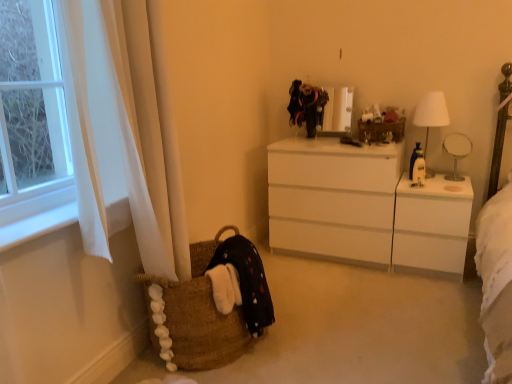
The image size is (512, 384). What do you see at coordinates (432, 225) in the screenshot?
I see `white glossy changing table at right` at bounding box center [432, 225].

What do you see at coordinates (198, 315) in the screenshot? The image size is (512, 384). I see `brown woven basket at lower left` at bounding box center [198, 315].

The height and width of the screenshot is (384, 512). What do you see at coordinates (381, 130) in the screenshot?
I see `wooden basket at center` at bounding box center [381, 130].

Where is `velvet black dress at upper center, which ranks as the second clothing in front-to-back order`? velvet black dress at upper center, which ranks as the second clothing in front-to-back order is located at coordinates (306, 105).

You are a GUI agent. You are given a task and a screenshot of the screen. Output one action in this format:
    pyautogui.click(x=<x>, y=<y>)
    Task: Click on the black cotton dress at lower left, which ranks as the first clothing in bottom-to-top order
    The width and height of the screenshot is (512, 384).
    Given the screenshot: What is the action you would take?
    pyautogui.click(x=248, y=281)

What do you see at coordinates (248, 281) in the screenshot?
I see `black cotton dress at lower left, which appears as the second clothing when viewed from the back` at bounding box center [248, 281].

Find the location of a particular element. white glossy table lamp at right is located at coordinates (456, 152).

The height and width of the screenshot is (384, 512). What do you see at coordinates (364, 207) in the screenshot?
I see `white glossy chest of drawers at center` at bounding box center [364, 207].

At what (x,y) coordinates should I click in order to perform the action: click on white glossy changing table at right. Please return your answer as a coordinate pair (x, y). This screenshot has height=384, width=512. Looking at the image, I should click on (432, 225).

Considering the positions of objects wooden basket at center and velvet black dress at upper center, which is the 1th clothing in back-to-front order, in the image provided, who is more to the left, wooden basket at center or velvet black dress at upper center, which is the 1th clothing in back-to-front order,?

velvet black dress at upper center, which is the 1th clothing in back-to-front order, is more to the left.

Is wooden basket at center facing away from velvet black dress at upper center, which is the 1th clothing in back-to-front order?

That's not correct — wooden basket at center is not looking away from velvet black dress at upper center, which is the 1th clothing in back-to-front order.

Measure the distance from wooden basket at center to velvet black dress at upper center, which ranks as the second clothing in front-to-back order.

wooden basket at center and velvet black dress at upper center, which ranks as the second clothing in front-to-back order, are 15.30 inches apart from each other.

Is wooden basket at center in contact with velvet black dress at upper center, the second clothing ordered from the bottom?

wooden basket at center is not next to velvet black dress at upper center, the second clothing ordered from the bottom, and they're not touching.

From the image's perspective, is velvet black dress at upper center, which ranks as the second clothing in front-to-back order, located above or below black cotton dress at lower left, which appears as the second clothing when viewed from the back?

velvet black dress at upper center, which ranks as the second clothing in front-to-back order, is situated higher than black cotton dress at lower left, which appears as the second clothing when viewed from the back, in the image.

Can you confirm if velvet black dress at upper center, which ranks as the second clothing in front-to-back order, is positioned to the right of black cotton dress at lower left, which ranks as the first clothing in bottom-to-top order?

Yes.

From a real-world perspective, between velvet black dress at upper center, the second clothing ordered from the bottom, and black cotton dress at lower left, which ranks as the first clothing in bottom-to-top order, who is vertically higher?

velvet black dress at upper center, the second clothing ordered from the bottom, from a real-world perspective.

In the image, there is a velvet black dress at upper center, which ranks as the first clothing in top-to-bottom order. Where is `clothing below it (from the image's perspective)`? The height and width of the screenshot is (384, 512). clothing below it (from the image's perspective) is located at coordinates (248, 281).

Between white glossy changing table at right and black cotton dress at lower left, arranged as the 2th clothing when viewed from the top, which one has larger width?

Wider between the two is white glossy changing table at right.

From a real-world perspective, between white glossy changing table at right and black cotton dress at lower left, which is the 1th clothing in front-to-back order, who is vertically lower?

From a 3D spatial view, white glossy changing table at right is below.

Is white glossy changing table at right in front of or behind black cotton dress at lower left, which is the 1th clothing in front-to-back order, in the image?

white glossy changing table at right is positioned farther from the viewer than black cotton dress at lower left, which is the 1th clothing in front-to-back order.

Considering the relative sizes of white glossy changing table at right and black cotton dress at lower left, which ranks as the first clothing in bottom-to-top order, in the image provided, is white glossy changing table at right shorter than black cotton dress at lower left, which ranks as the first clothing in bottom-to-top order,?

In fact, white glossy changing table at right may be taller than black cotton dress at lower left, which ranks as the first clothing in bottom-to-top order.

Can you confirm if white fabric lampshade at right is wider than wooden basket at center?

Yes.

From the picture: Is white fabric lampshade at right oriented towards wooden basket at center?

No, white fabric lampshade at right is not oriented towards wooden basket at center.

Looking at this image, how distant is white fabric lampshade at right from wooden basket at center?

The distance of white fabric lampshade at right from wooden basket at center is 22.67 centimeters.

Is white fabric lampshade at right situated inside wooden basket at center or outside?

white fabric lampshade at right is not inside wooden basket at center, it's outside.

In the scene shown: Considering the sizes of white glossy table lamp at right and white glossy changing table at right in the image, is white glossy table lamp at right bigger or smaller than white glossy changing table at right?

white glossy table lamp at right is smaller than white glossy changing table at right.

Identify the location of changing table that appears below the white glossy table lamp at right (from the image's perspective). The width and height of the screenshot is (512, 384). (432, 225).

Is white fabric at left wider than brown woven basket at lower left?

Incorrect, the width of white fabric at left does not surpass that of brown woven basket at lower left.

Is point (17, 244) less distant than point (233, 313)?

Yes, it is in front of point (233, 313).

Would you say white fabric at left contains brown woven basket at lower left?

Definitely not — brown woven basket at lower left is not inside white fabric at left.

Is brown woven basket at lower left positioned far away from wooden basket at center?

Indeed, brown woven basket at lower left is not near wooden basket at center.

Is wooden basket at center at the back of brown woven basket at lower left?

brown woven basket at lower left is not turned away from wooden basket at center.

From a real-world perspective, is brown woven basket at lower left positioned over wooden basket at center based on gravity?

No, from a real-world perspective, brown woven basket at lower left is not above wooden basket at center.

What's the angular difference between brown woven basket at lower left and wooden basket at center's facing directions?

The facing directions of brown woven basket at lower left and wooden basket at center are 93.3 degrees apart.

Where is `clothing behind the wooden basket at center`? This screenshot has height=384, width=512. clothing behind the wooden basket at center is located at coordinates (306, 105).

I want to click on clothing above the black cotton dress at lower left, the first clothing when ordered from left to right (from a real-world perspective), so click(306, 105).

From the image, which object appears to be farther from white glossy table lamp at right, brown woven basket at lower left or white glossy chest of drawers at center?

Based on the image, brown woven basket at lower left appears to be further to white glossy table lamp at right.

Estimate the real-world distances between objects in this image. Which object is further from white fabric lampshade at right, white glossy table lamp at right or brown woven basket at lower left?

brown woven basket at lower left is further to white fabric lampshade at right.

Considering their positions, is wooden basket at center positioned further to brown woven basket at lower left than white glossy chest of drawers at center?

wooden basket at center lies further to brown woven basket at lower left than the other object.

Considering their positions, is white fabric lampshade at right positioned further to brown woven basket at lower left than white glossy changing table at right?

Among the two, white fabric lampshade at right is located further to brown woven basket at lower left.

Based on their spatial positions, is white fabric lampshade at right or white fabric at left further from white glossy table lamp at right?

white fabric at left.

Considering their positions, is brown woven basket at lower left positioned closer to white glossy table lamp at right than velvet black dress at upper center, the first clothing viewed from the right?

velvet black dress at upper center, the first clothing viewed from the right, lies closer to white glossy table lamp at right than the other object.

When comparing their distances from white glossy table lamp at right, does brown woven basket at lower left or black cotton dress at lower left, which is the second clothing in right-to-left order, seem closer?

black cotton dress at lower left, which is the second clothing in right-to-left order.

Estimate the real-world distances between objects in this image. Which object is closer to white glossy changing table at right, velvet black dress at upper center, which ranks as the second clothing in front-to-back order, or brown woven basket at lower left?

The object closer to white glossy changing table at right is velvet black dress at upper center, which ranks as the second clothing in front-to-back order.

Identify the location of clothing between black cotton dress at lower left, which is the second clothing in right-to-left order, and white glossy changing table at right. (306, 105).

I want to click on picnic basket between white fabric at left and velvet black dress at upper center, the second clothing ordered from the bottom, in the front-back direction, so click(x=198, y=315).

This screenshot has height=384, width=512. I want to click on lamp positioned between brown woven basket at lower left and velvet black dress at upper center, which is the 1th clothing in back-to-front order, from near to far, so click(x=431, y=113).

The width and height of the screenshot is (512, 384). In order to click on chest of drawers between brown woven basket at lower left and white glossy changing table at right in this screenshot , I will do [364, 207].